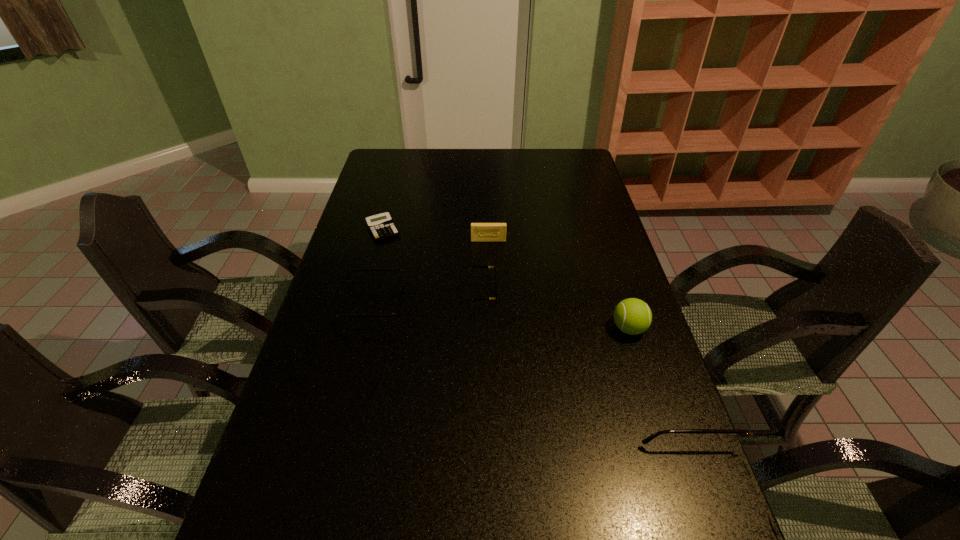
In order to click on blank area in the image that satisfies the following two spatial constraints: 1. on the front-facing side of the shortest spectacles; 2. on the left side of the tennis ball in this screenshot , I will do pyautogui.click(x=477, y=328).

You are a GUI agent. You are given a task and a screenshot of the screen. Output one action in this format:
    pyautogui.click(x=<x>, y=<y>)
    Task: Click on the blank area in the image that satisfies the following two spatial constraints: 1. at the front of the videotape with spools; 2. on the right side of the tallest object
    This screenshot has width=960, height=540.
    Given the screenshot: What is the action you would take?
    pyautogui.click(x=491, y=328)

Locate an element on the screen. The height and width of the screenshot is (540, 960). vacant position in the image that satisfies the following two spatial constraints: 1. at the front of the videotape with spools; 2. on the right side of the tallest object is located at coordinates (491, 328).

Where is `free space that satisfies the following two spatial constraints: 1. at the hinge ends of the second tallest spectacles; 2. on the left side of the tennis ball`? Image resolution: width=960 pixels, height=540 pixels. free space that satisfies the following two spatial constraints: 1. at the hinge ends of the second tallest spectacles; 2. on the left side of the tennis ball is located at coordinates (367, 328).

Find the location of a particular element. This screenshot has width=960, height=540. free region that satisfies the following two spatial constraints: 1. at the front of the videotape with spools; 2. on the front-facing side of the second shortest object is located at coordinates (490, 292).

I want to click on vacant space that satisfies the following two spatial constraints: 1. at the front of the tennis ball with spools; 2. on the left side of the videotape, so click(491, 328).